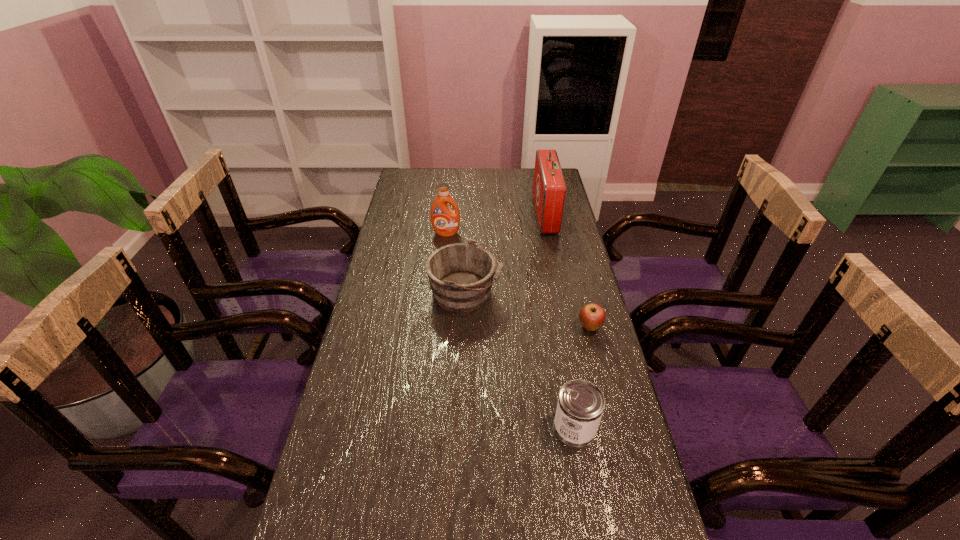
At what (x,y) coordinates should I click in order to perform the action: click on free space that is in between the nearest object and the detergent. Please return your answer as a coordinate pair (x, y). Looking at the image, I should click on (511, 330).

Find the location of a particular element. The width and height of the screenshot is (960, 540). unoccupied position between the tallest object and the second tallest object is located at coordinates (495, 224).

You are a GUI agent. You are given a task and a screenshot of the screen. Output one action in this format:
    pyautogui.click(x=<x>, y=<y>)
    Task: Click on the third closest object to the shortest object
    
    Given the screenshot: What is the action you would take?
    pyautogui.click(x=549, y=187)

At what (x,y) coordinates should I click in order to perform the action: click on object identified as the third closest to the wine bucket. Please return your answer as a coordinate pair (x, y). The width and height of the screenshot is (960, 540). Looking at the image, I should click on (549, 187).

Where is `blank space that satisfies the following two spatial constraints: 1. on the front-facing side of the detergent; 2. on the right side of the apple`? The width and height of the screenshot is (960, 540). blank space that satisfies the following two spatial constraints: 1. on the front-facing side of the detergent; 2. on the right side of the apple is located at coordinates (437, 327).

Locate an element on the screen. vacant area that satisfies the following two spatial constraints: 1. on the side of the first-aid kit with the first aid cross symbol; 2. on the front-facing side of the second tallest object is located at coordinates (549, 233).

Where is `free space in the image that satisfies the following two spatial constraints: 1. on the side of the tallest object with the first aid cross symbol; 2. on the front-facing side of the second tallest object`? The image size is (960, 540). free space in the image that satisfies the following two spatial constraints: 1. on the side of the tallest object with the first aid cross symbol; 2. on the front-facing side of the second tallest object is located at coordinates (549, 233).

Locate an element on the screen. blank area in the image that satisfies the following two spatial constraints: 1. on the front-facing side of the nearest object; 2. on the right side of the fourth shortest object is located at coordinates (427, 427).

Find the location of `vacant space that satisfies the following two spatial constraints: 1. on the side of the first-aid kit with the first aid cross symbol; 2. on the back side of the shortest object`. vacant space that satisfies the following two spatial constraints: 1. on the side of the first-aid kit with the first aid cross symbol; 2. on the back side of the shortest object is located at coordinates (568, 327).

The width and height of the screenshot is (960, 540). Identify the location of free space that satisfies the following two spatial constraints: 1. on the side of the apple with the first aid cross symbol; 2. on the left side of the first-aid kit. (568, 327).